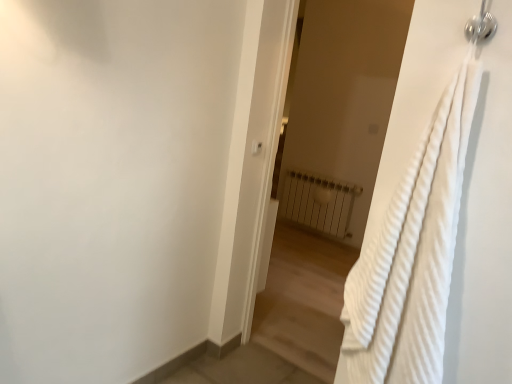
Where is `white textured towel at right`? Image resolution: width=512 pixels, height=384 pixels. white textured towel at right is located at coordinates (413, 253).

Describe the element at coordinates (256, 147) in the screenshot. I see `white plastic light switch at upper center` at that location.

I want to click on white plastic light switch at upper center, so click(256, 147).

Image resolution: width=512 pixels, height=384 pixels. Find the location of `white textured towel at right`. white textured towel at right is located at coordinates (413, 253).

Is white plastic light switch at upper center facing away from white metallic radiator at center?

white plastic light switch at upper center is not turned away from white metallic radiator at center.

Does point (257, 150) lie behind point (329, 194)?

No, (257, 150) is closer to viewer.

Based on the photo, what's the angular difference between white plastic light switch at upper center and white metallic radiator at center's facing directions?

The angle between the facing direction of white plastic light switch at upper center and the facing direction of white metallic radiator at center is 90.2 degrees.

Does white plastic light switch at upper center have a greater height compared to white metallic radiator at center?

In fact, white plastic light switch at upper center may be shorter than white metallic radiator at center.

Who is smaller, white textured towel at right or white plastic light switch at upper center?

Smaller between the two is white plastic light switch at upper center.

Is white textured towel at right beside white plastic light switch at upper center?

No, white textured towel at right is not next to white plastic light switch at upper center.

Does point (281, 234) lie in front of point (260, 147)?

That is False.

Is white textured towel at right positioned behind white plastic light switch at upper center?

No, white textured towel at right is closer to the viewer.

From a real-world perspective, which object rests below the other?

In real-world perspective, white metallic radiator at center is lower.

Does white textured towel at right have a greater width compared to white metallic radiator at center?

Incorrect, the width of white textured towel at right does not surpass that of white metallic radiator at center.

Which of these two, white textured towel at right or white metallic radiator at center, is smaller?

With smaller size is white metallic radiator at center.

How many degrees apart are the facing directions of white textured towel at right and white textured towel at right?

The angle between the facing direction of white textured towel at right and the facing direction of white textured towel at right is 0.398 degrees.

Between point (402, 259) and point (269, 302), which one is positioned in front?

The point (402, 259) is closer to the camera.

From a real-world perspective, is white textured towel at right on top of white textured towel at right?

Yes, from a real-world perspective, white textured towel at right is above white textured towel at right.

Would you say white textured towel at right is outside white textured towel at right?

Yes, white textured towel at right is located beyond the bounds of white textured towel at right.

Consider the image. In terms of size, does white textured towel at right appear bigger or smaller than white plastic light switch at upper center?

In the image, white textured towel at right appears to be larger than white plastic light switch at upper center.

Based on the photo, which object is wider, white textured towel at right or white plastic light switch at upper center?

Wider between the two is white textured towel at right.

Is point (445, 240) farther from camera compared to point (261, 147)?

No, it is not.

Could you tell me if white metallic radiator at center is turned towards white textured towel at right?

Yes, white metallic radiator at center faces towards white textured towel at right.

From a real-world perspective, is white metallic radiator at center below white textured towel at right?

Yes, from a real-world perspective, white metallic radiator at center is below white textured towel at right.

Is white metallic radiator at center taller than white textured towel at right?

In fact, white metallic radiator at center may be shorter than white textured towel at right.

Considering the sizes of white metallic radiator at center and white plastic light switch at upper center in the image, is white metallic radiator at center taller or shorter than white plastic light switch at upper center?

In the image, white metallic radiator at center appears to be taller than white plastic light switch at upper center.

Considering the relative positions of white metallic radiator at center and white plastic light switch at upper center in the image provided, is white metallic radiator at center to the left of white plastic light switch at upper center from the viewer's perspective?

In fact, white metallic radiator at center is to the right of white plastic light switch at upper center.

There is a white metallic radiator at center. Where is `light switch above it (from a real-world perspective)`? light switch above it (from a real-world perspective) is located at coordinates (256, 147).

The width and height of the screenshot is (512, 384). I want to click on screen door located in front of the white plastic light switch at upper center, so tap(337, 125).

Based on the photo, considering their positions, is white textured towel at right positioned further to white plastic light switch at upper center than white metallic radiator at center?

white metallic radiator at center lies further to white plastic light switch at upper center than the other object.

Based on their spatial positions, is white textured towel at right or white metallic radiator at center closer to white plastic light switch at upper center?

white textured towel at right lies closer to white plastic light switch at upper center than the other object.

Looking at the image, which one is located closer to white textured towel at right, white plastic light switch at upper center or white metallic radiator at center?

The object closer to white textured towel at right is white plastic light switch at upper center.

When comparing their distances from white textured towel at right, does white metallic radiator at center or white plastic light switch at upper center seem closer?

white plastic light switch at upper center lies closer to white textured towel at right than the other object.

From the image, which object appears to be farther from white metallic radiator at center, white textured towel at right or white textured towel at right?

white textured towel at right lies further to white metallic radiator at center than the other object.

Considering their positions, is white textured towel at right positioned further to white plastic light switch at upper center than white textured towel at right?

Based on the image, white textured towel at right appears to be further to white plastic light switch at upper center.

Based on the photo, based on their spatial positions, is white metallic radiator at center or white plastic light switch at upper center further from white textured towel at right?

white plastic light switch at upper center is further to white textured towel at right.

Looking at the image, which one is located closer to white metallic radiator at center, white textured towel at right or white plastic light switch at upper center?

white plastic light switch at upper center is positioned closer to the anchor white metallic radiator at center.

Where is `light switch located between white textured towel at right and white metallic radiator at center in the depth direction`? The image size is (512, 384). light switch located between white textured towel at right and white metallic radiator at center in the depth direction is located at coordinates (256, 147).

The image size is (512, 384). I want to click on screen door located between white textured towel at right and white metallic radiator at center in the depth direction, so tap(337, 125).

Image resolution: width=512 pixels, height=384 pixels. I want to click on screen door positioned between white textured towel at right and white plastic light switch at upper center from near to far, so click(x=337, y=125).

Where is `light switch between white textured towel at right and white metallic radiator at center from front to back`? The width and height of the screenshot is (512, 384). light switch between white textured towel at right and white metallic radiator at center from front to back is located at coordinates (256, 147).